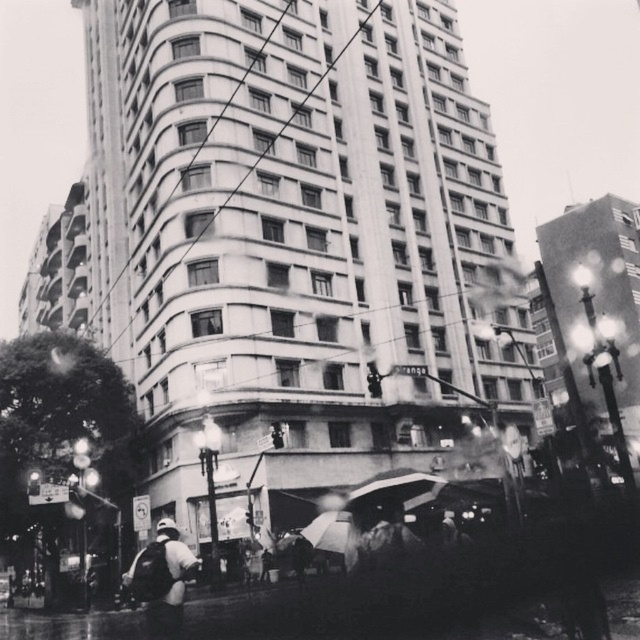
Question: Which point appears farthest from the camera in this image?

Choices:
 (A) (x=320, y=545)
 (B) (x=166, y=611)

Answer: (A)

Question: Which of the following is the farthest from the observer?

Choices:
 (A) transparent plastic umbrella at center
 (B) black matte umbrella at center

Answer: (A)

Question: Can you confirm if white fabric backpack at lower left is wider than transparent plastic umbrella at center?

Choices:
 (A) no
 (B) yes

Answer: (B)

Question: Which point is farther to the camera?

Choices:
 (A) (448, 483)
 (B) (344, 550)

Answer: (A)

Question: Can you confirm if black matte umbrella at center is positioned below transparent plastic umbrella at center?

Choices:
 (A) no
 (B) yes

Answer: (A)

Question: Observing the image, what is the correct spatial positioning of black matte umbrella at center in reference to transparent plastic umbrella at center?

Choices:
 (A) right
 (B) left

Answer: (A)